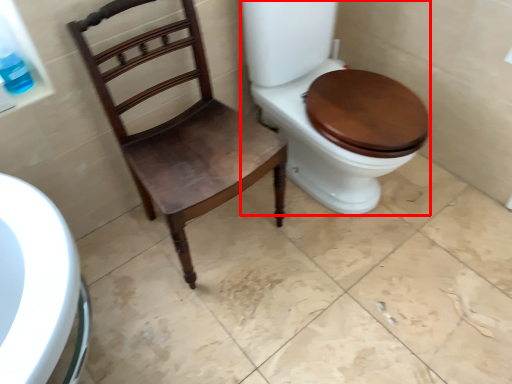
Question: From the image's perspective, considering the relative positions of toilet (annotated by the red box) and chair in the image provided, where is toilet (annotated by the red box) located with respect to the staircase?

Choices:
 (A) below
 (B) above

Answer: (B)